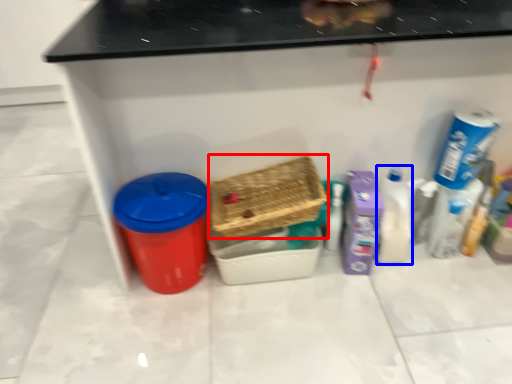
Question: Among these objects, which one is nearest to the camera, basket (highlighted by a red box) or cleaning product (highlighted by a blue box)?

Choices:
 (A) basket
 (B) cleaning product

Answer: (A)